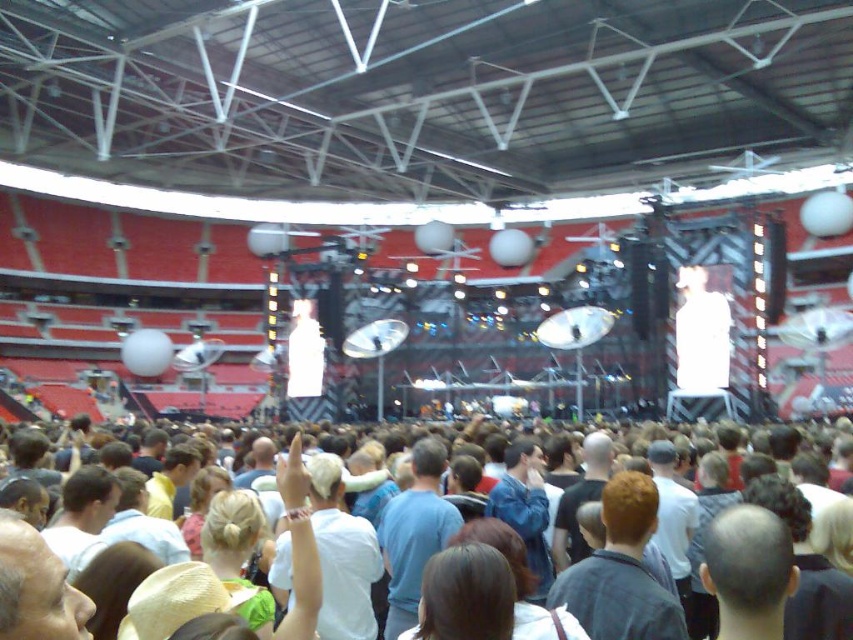
Question: Which is farther from the bald head at center?

Choices:
 (A) blue denim jacket at center
 (B) dark blue shirt at center

Answer: (B)

Question: Among these points, which one is nearest to the camera?

Choices:
 (A) tap(735, 513)
 (B) tap(19, 589)
 (C) tap(404, 504)

Answer: (B)

Question: Does white cotton crowd at center come in front of bald head at center?

Choices:
 (A) no
 (B) yes

Answer: (A)

Question: Does light brown hair at lower left have a larger size compared to dark blue shirt at center?

Choices:
 (A) yes
 (B) no

Answer: (B)

Question: Can you confirm if light brown hair at lower left is positioned to the right of blue denim jacket at center?

Choices:
 (A) yes
 (B) no

Answer: (B)

Question: Which object appears closest to the camera in this image?

Choices:
 (A) white matte shirt at center
 (B) blue cotton shirt at center
 (C) bald head at center
 (D) white cotton crowd at center

Answer: (C)